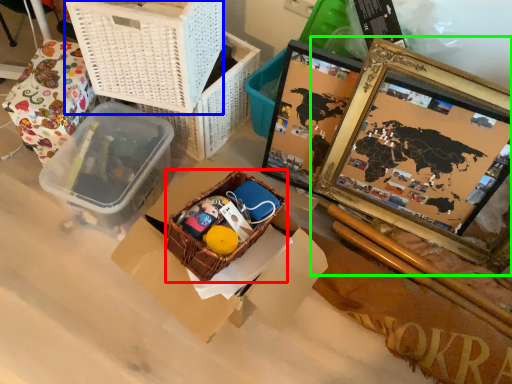
Question: Based on their relative distances, which object is nearer to gift basket (highlighted by a red box)? Choose from basket (highlighted by a blue box) and picture frame (highlighted by a green box).

Choices:
 (A) basket
 (B) picture frame

Answer: (A)